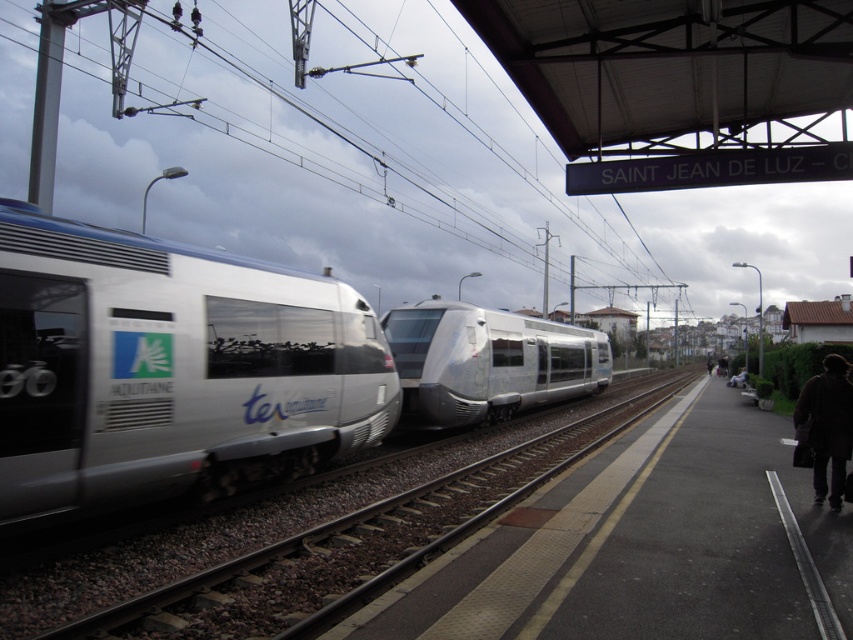
You are a maintenance worker checking the platform. You need to determine if the silver metallic train track at center can be raised to match the height of the silver metallic bullet train at center. Based on the scene, is this possible?

The silver metallic train track at center is not as tall as the silver metallic bullet train at center, so raising the track to match the train height is not feasible as it would disrupt the track system.

You are standing at the platform of SAINT JEAN DE LUZ station and want to board the silver metallic train at left. The platform has a yellow tactile paving strip along its edge. To ensure safety, you must stay within the platform area. Can you confirm if the point at coordinates (171,369) is located on the silver metallic train at left, and thus within the platform area?

The point at coordinates (171,369) is located on the silver metallic train at left, which is within the platform area. Therefore, you are safe to board the train from that point.

You are standing at the center of the platform and want to board the silver metallic train at left. Given that the platform is 10 meters wide, can you reach the train without crossing the yellow tactile paving strip?

The silver metallic train at left is located at point coordinates, but without specific spatial relationships or distances between the platform edge and the train, it is impossible to determine if crossing the tactile strip is necessary. However, typically, tactile paving is placed near the edge for safety, so if the train is positioned close to the edge where the tactile strip is, boarding might require staying within the safe area. Without exact measurements, a definitive answer isn